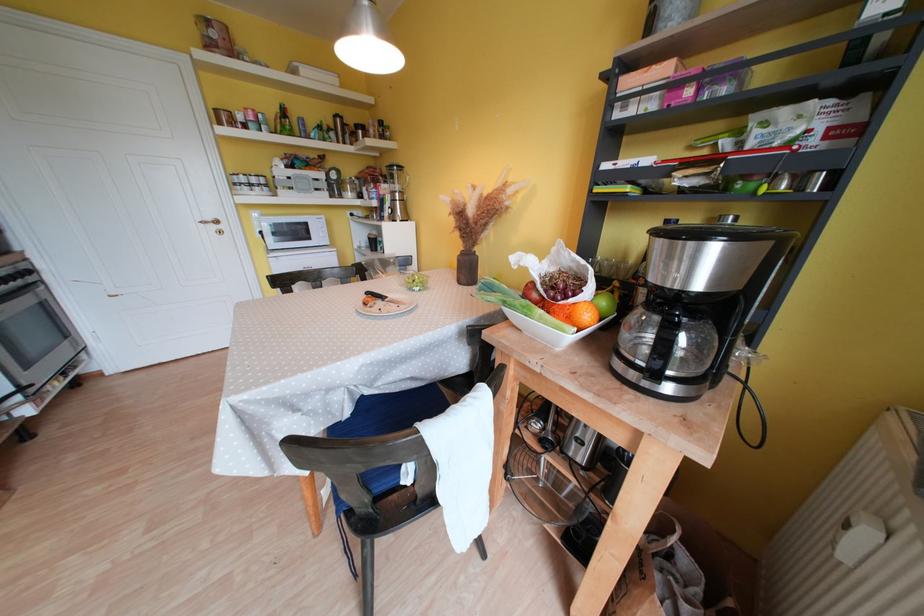
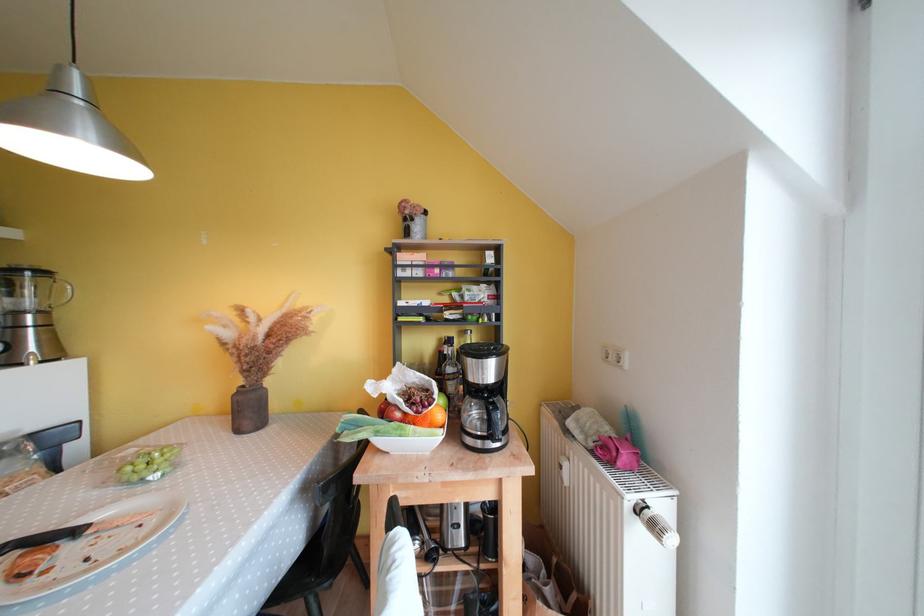
Where in the second image is the point corresponding to (x=407, y=196) from the first image?

(49, 315)